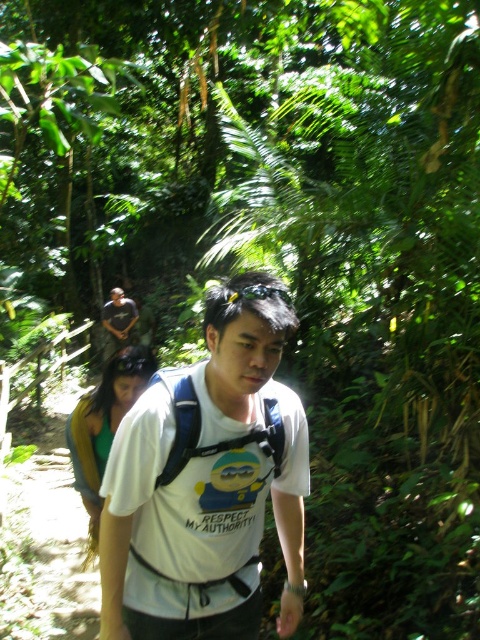
Question: Which of the following is the closest to the observer?

Choices:
 (A) dark gray t-shirt at upper left
 (B) white cotton t-shirt at center
 (C) green fabric backpack at center

Answer: (B)

Question: Considering the relative positions of green fabric backpack at center and dark gray t-shirt at upper left in the image provided, where is green fabric backpack at center located with respect to dark gray t-shirt at upper left?

Choices:
 (A) right
 (B) left

Answer: (A)

Question: Does white cotton t-shirt at center have a larger size compared to green fabric backpack at center?

Choices:
 (A) no
 (B) yes

Answer: (A)

Question: Which of these objects is positioned farthest from the dark gray t-shirt at upper left?

Choices:
 (A) white cotton t-shirt at center
 (B) green fabric backpack at center

Answer: (A)

Question: Which object is closer to the camera taking this photo?

Choices:
 (A) dark gray t-shirt at upper left
 (B) green fabric backpack at center

Answer: (B)

Question: Is white cotton t-shirt at center further to camera compared to green fabric backpack at center?

Choices:
 (A) yes
 (B) no

Answer: (B)